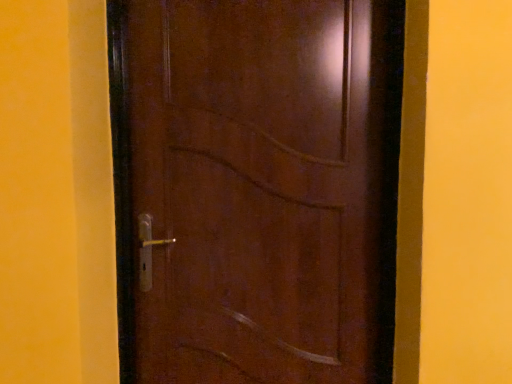
This screenshot has width=512, height=384. Describe the element at coordinates (256, 189) in the screenshot. I see `glossy wood door at center` at that location.

You are a GUI agent. You are given a task and a screenshot of the screen. Output one action in this format:
    pyautogui.click(x=<x>, y=<y>)
    Task: Click on the glossy wood door at center
    This screenshot has width=512, height=384.
    Given the screenshot: What is the action you would take?
    pyautogui.click(x=256, y=189)

This screenshot has width=512, height=384. What are the coordinates of `glossy wood door at center` in the screenshot? It's located at (256, 189).